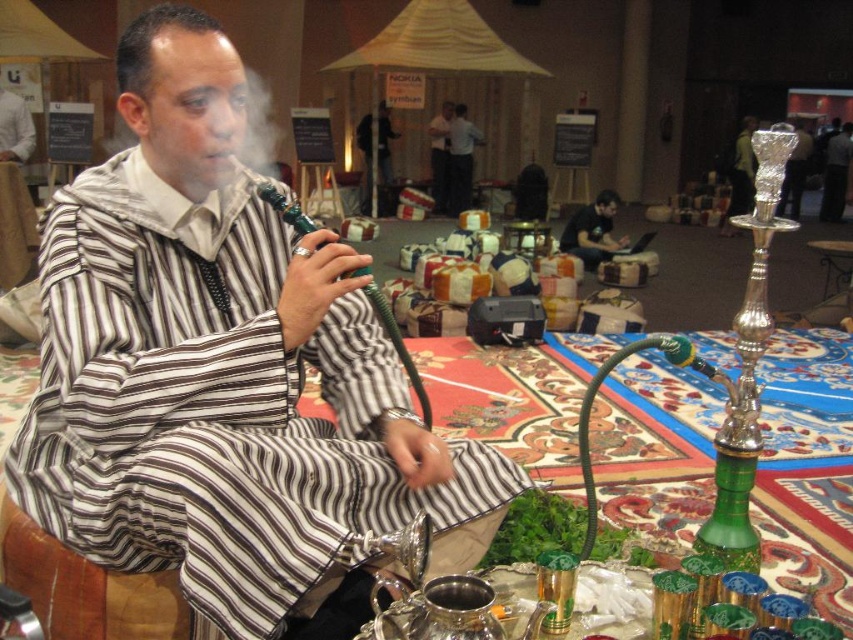
You are organizing a cultural event and need to ensure there is enough space between the striped fabric man at center and the dark blue fabric at center for attendees to walk comfortably. According to the scene, which object is wider and might require more space?

The striped fabric man at center is wider than the dark blue fabric at center, so it would require more space.

From the picture: You are a delivery person who needs to place a package on the table between the striped fabric man at center and the matte black laptop at center. Is there enough space to place the package between them?

The striped fabric man at center and the matte black laptop at center are 31.87 feet apart, so yes, there is enough space to place the package between them since the distance is sufficient.